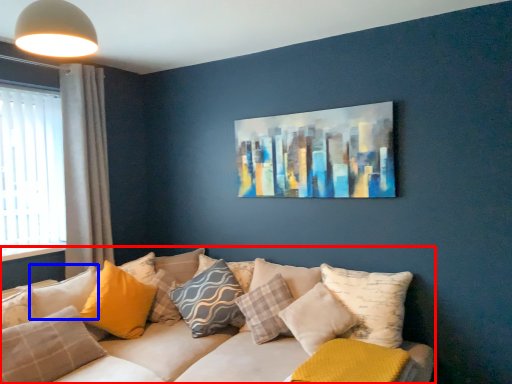
Question: Which object is further to the camera taking this photo, studio couch (highlighted by a red box) or pillow (highlighted by a blue box)?

Choices:
 (A) studio couch
 (B) pillow

Answer: (B)